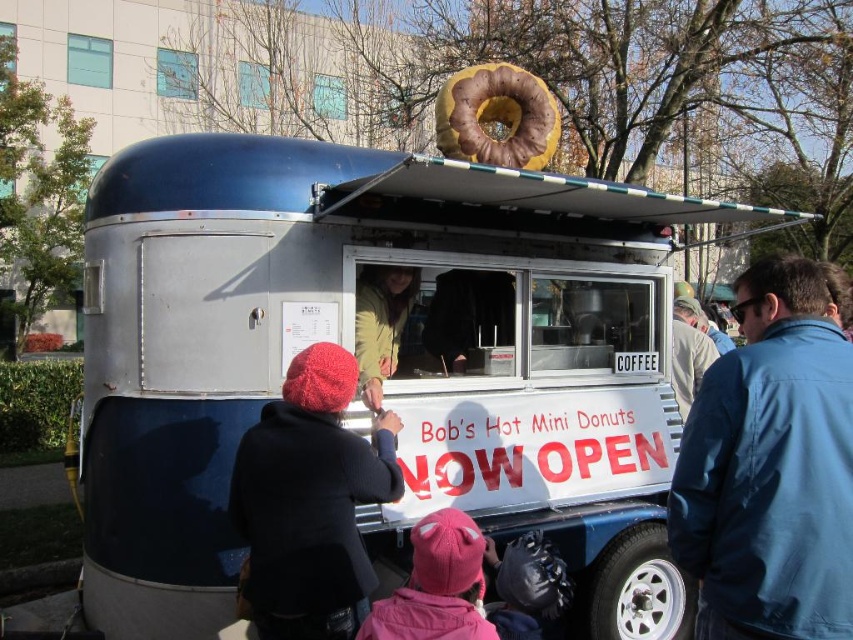
You are a customer waiting in line at Bob s Hot Mini Donuts and you see two hats on the ground near the food truck. The knitted wool hat at lower left and the pink fleece hat at lower center. Which hat is closer to you?

The knitted wool hat at lower left is closer to you because the pink fleece hat at lower center is behind it.